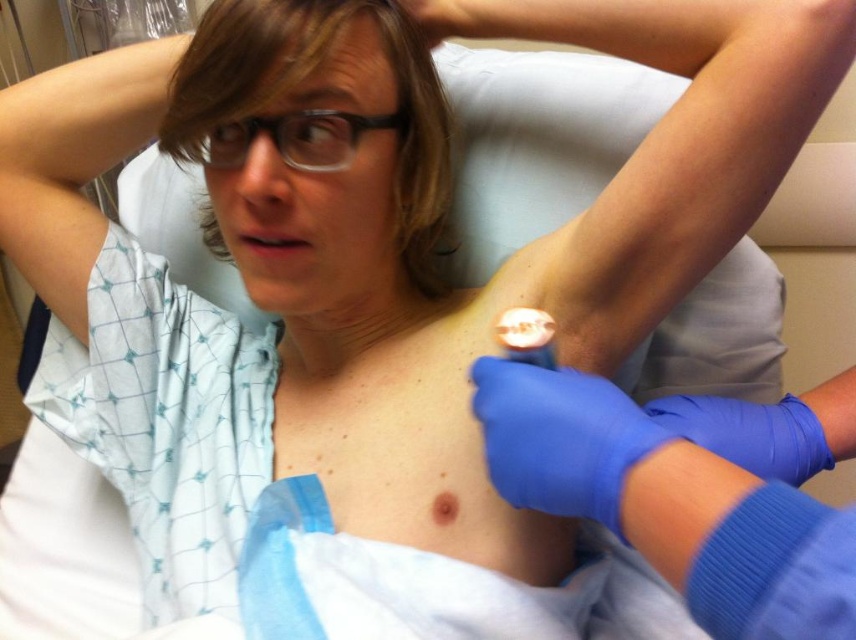
You are a nurse assisting in a medical procedure. You need to access the blue rubber glove at upper right, which is currently under the blue latex glove at upper center. How should you proceed to retrieve it without disturbing the patient?

To retrieve the blue rubber glove at upper right, carefully lift the blue latex glove at upper center first, as it is positioned above the blue rubber glove. This way, you can access the glove underneath without moving the patient.

You are a medical student observing a procedure. You notice two points marked on the patient. The first point is at coordinate point (556, 392) and the second is at point (727, 458). From the patient perspective, which point is closer to their head?

Point (556, 392) is in front of point (727, 458), so from the patient perspective, the first point is closer to their head.

You are a medical technician who needs to ensure the device is positioned at a safe distance from the patient. According to the guidelines, the device must be kept at least 20 inches away from the patient to avoid discomfort. Can you confirm if the device at point (782, 452) is within the required distance?

The distance of point (782, 452) from the viewer is 21.24 inches, which is more than the required 20 inches, so the device is positioned safely and within guidelines.